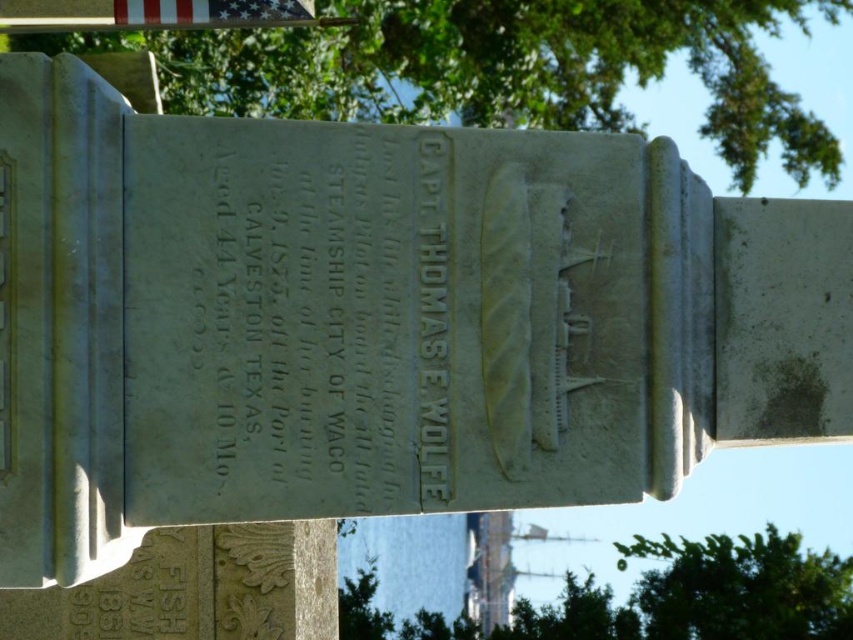
Is green leafy tree at center shorter than silky fabric flag at upper left?

No, green leafy tree at center is not shorter than silky fabric flag at upper left.

Does green leafy tree at center appear on the left side of silky fabric flag at upper left?

No, green leafy tree at center is not to the left of silky fabric flag at upper left.

Image resolution: width=853 pixels, height=640 pixels. I want to click on green leafy tree at center, so click(x=657, y=596).

Identify the location of green leafy tree at center. (657, 596).

Does point (165, 67) lie behind point (759, 596)?

No, (165, 67) is closer to viewer.

I want to click on green leafy tree at upper center, so (x=517, y=68).

In the scene shown: Is green leafy tree at upper center further to camera compared to silky fabric flag at upper left?

Yes, it is behind silky fabric flag at upper left.

Looking at this image, can you confirm if green leafy tree at upper center is positioned to the right of silky fabric flag at upper left?

Correct, you'll find green leafy tree at upper center to the right of silky fabric flag at upper left.

The image size is (853, 640). Find the location of `green leafy tree at upper center`. green leafy tree at upper center is located at coordinates (517, 68).